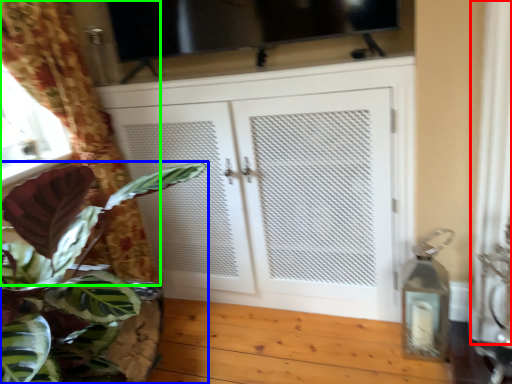
Question: Based on their relative distances, which object is farther from curtain (highlighted by a red box)? Choose from houseplant (highlighted by a blue box) and curtain (highlighted by a green box).

Choices:
 (A) houseplant
 (B) curtain

Answer: (B)